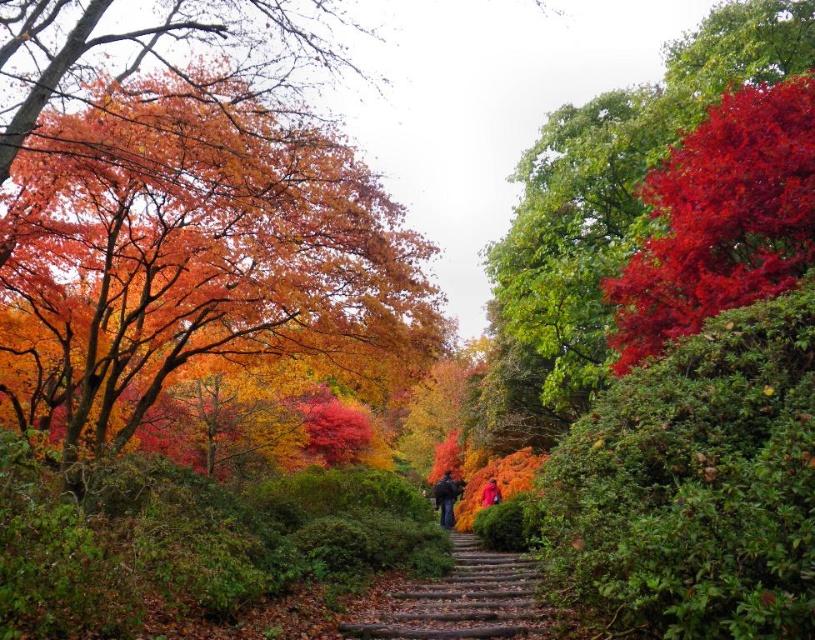
How distant is vivid red leaves at upper right from brown wooden stairs at center?

6.80 meters

Between vivid red leaves at upper right and brown wooden stairs at center, which one appears on the right side from the viewer's perspective?

Positioned to the right is vivid red leaves at upper right.

Does point (554, 385) come behind point (408, 621)?

Yes, it is.

Find the location of a particular element. This screenshot has height=640, width=815. vivid red leaves at upper right is located at coordinates (604, 216).

Measure the distance from bright red leaves at upper right to brown wooden stairs at center.

3.69 meters

Between bright red leaves at upper right and brown wooden stairs at center, which one has less height?

brown wooden stairs at center is shorter.

What do you see at coordinates (720, 220) in the screenshot? The height and width of the screenshot is (640, 815). I see `bright red leaves at upper right` at bounding box center [720, 220].

You are a GUI agent. You are given a task and a screenshot of the screen. Output one action in this format:
    pyautogui.click(x=<x>, y=<y>)
    Task: Click on the bright red leaves at upper right
    The width and height of the screenshot is (815, 640).
    Given the screenshot: What is the action you would take?
    pyautogui.click(x=720, y=220)

Which is more to the left, vivid red leaves at upper right or bright red leaves at upper right?

bright red leaves at upper right is more to the left.

Is vivid red leaves at upper right to the left of bright red leaves at upper right from the viewer's perspective?

No, vivid red leaves at upper right is not to the left of bright red leaves at upper right.

Which is in front, point (534, 186) or point (650, 292)?

Point (650, 292)

You are a GUI agent. You are given a task and a screenshot of the screen. Output one action in this format:
    pyautogui.click(x=<x>, y=<y>)
    Task: Click on the vivid red leaves at upper right
    The width and height of the screenshot is (815, 640).
    Given the screenshot: What is the action you would take?
    pyautogui.click(x=604, y=216)